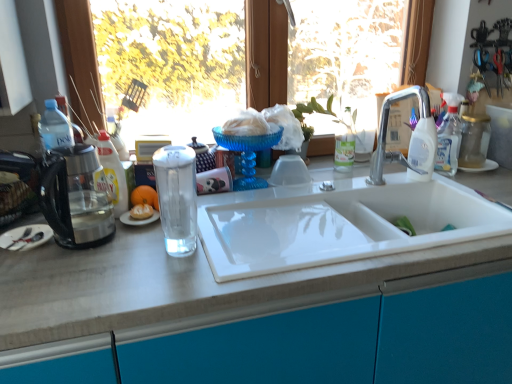
Question: Is translucent glass kettle at left aimed at white fluffy food at center?

Choices:
 (A) yes
 (B) no

Answer: (B)

Question: Considering the relative sizes of translucent glass kettle at left and white fluffy food at center in the image provided, is translucent glass kettle at left taller than white fluffy food at center?

Choices:
 (A) yes
 (B) no

Answer: (A)

Question: Does translucent glass kettle at left lie behind white fluffy food at center?

Choices:
 (A) yes
 (B) no

Answer: (B)

Question: Could white fluffy food at center be considered to be inside translucent glass kettle at left?

Choices:
 (A) yes
 (B) no

Answer: (B)

Question: Is translucent glass kettle at left at the left side of white fluffy food at center?

Choices:
 (A) yes
 (B) no

Answer: (A)

Question: Would you say orange matte at center is to the left or to the right of translucent glass kettle at left in the picture?

Choices:
 (A) left
 (B) right

Answer: (B)

Question: Which is correct: orange matte at center is inside translucent glass kettle at left, or outside of it?

Choices:
 (A) outside
 (B) inside

Answer: (A)

Question: In terms of width, does orange matte at center look wider or thinner when compared to translucent glass kettle at left?

Choices:
 (A) wide
 (B) thin

Answer: (B)

Question: From a real-world perspective, is orange matte at center positioned above or below translucent glass kettle at left?

Choices:
 (A) above
 (B) below

Answer: (B)

Question: Does point (162, 180) appear closer or farther from the camera than point (118, 319)?

Choices:
 (A) closer
 (B) farther

Answer: (B)

Question: From the image's perspective, is clear glass water at center located above or below white matte countertop at center?

Choices:
 (A) above
 (B) below

Answer: (A)

Question: Is clear glass water at center bigger or smaller than white matte countertop at center?

Choices:
 (A) big
 (B) small

Answer: (B)

Question: Is clear glass water at center situated inside white matte countertop at center or outside?

Choices:
 (A) outside
 (B) inside

Answer: (A)

Question: Is white glossy bottle at upper right wider or thinner than white fluffy food at center?

Choices:
 (A) thin
 (B) wide

Answer: (B)

Question: Considering their positions, is white glossy bottle at upper right located in front of or behind white fluffy food at center?

Choices:
 (A) behind
 (B) front

Answer: (A)